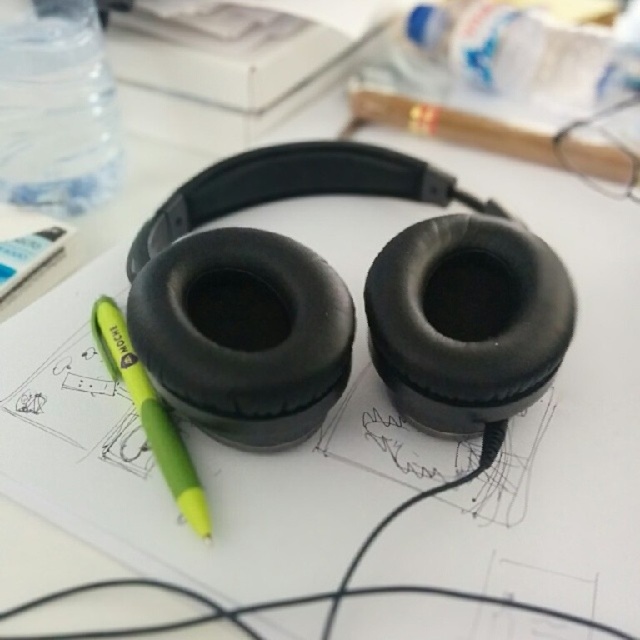
Question: Where is transparent plastic bottle at upper left located in relation to green plastic pen at lower left in the image?

Choices:
 (A) right
 (B) left

Answer: (B)

Question: Is transparent plastic bottle at upper left in front of green plastic pen at lower left?

Choices:
 (A) yes
 (B) no

Answer: (B)

Question: Which point is closer to the camera taking this photo?

Choices:
 (A) (67, 177)
 (B) (108, 321)

Answer: (B)

Question: Among these points, which one is farthest from the camera?

Choices:
 (A) (49, 173)
 (B) (109, 310)

Answer: (A)

Question: Is transparent plastic bottle at upper left positioned at the back of green plastic pen at lower left?

Choices:
 (A) no
 (B) yes

Answer: (B)